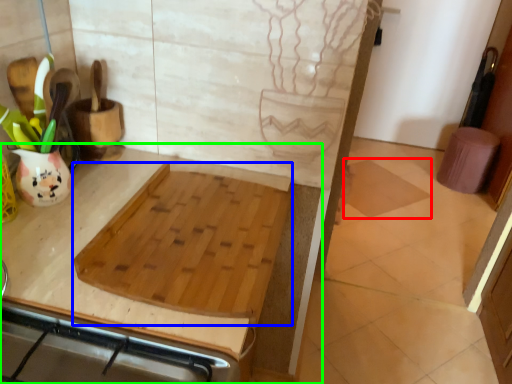
Question: Considering the real-world distances, which object is closest to tile (highlighted by a red box)? cutting board (highlighted by a blue box) or countertop (highlighted by a green box).

Choices:
 (A) cutting board
 (B) countertop

Answer: (B)